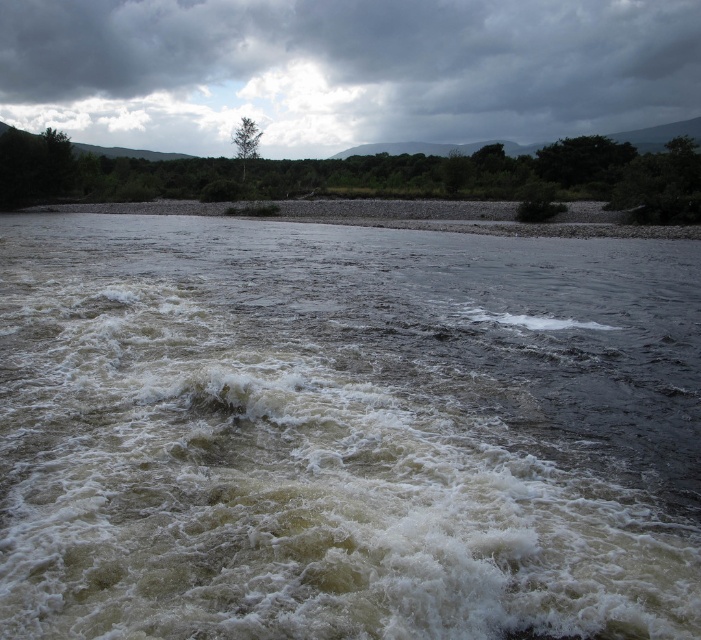
Question: Which point appears closest to the camera in this image?

Choices:
 (A) (x=294, y=316)
 (B) (x=252, y=148)
 (C) (x=660, y=209)
 (D) (x=294, y=129)

Answer: (A)

Question: Does white frothy water at center have a smaller size compared to green matte tree at upper center?

Choices:
 (A) yes
 (B) no

Answer: (A)

Question: Does white frothy water at center appear under green leafy tree at upper center?

Choices:
 (A) yes
 (B) no

Answer: (A)

Question: Where is white frothy water at center located in relation to green matte tree at upper center in the image?

Choices:
 (A) below
 (B) above

Answer: (A)

Question: Which of these objects is positioned farthest from the green leafy tree at upper center?

Choices:
 (A) green matte tree at upper center
 (B) cloudy sky at upper center

Answer: (B)

Question: Which point is farther from the camera taking this photo?

Choices:
 (A) pyautogui.click(x=494, y=182)
 (B) pyautogui.click(x=245, y=128)
 (C) pyautogui.click(x=690, y=109)

Answer: (C)